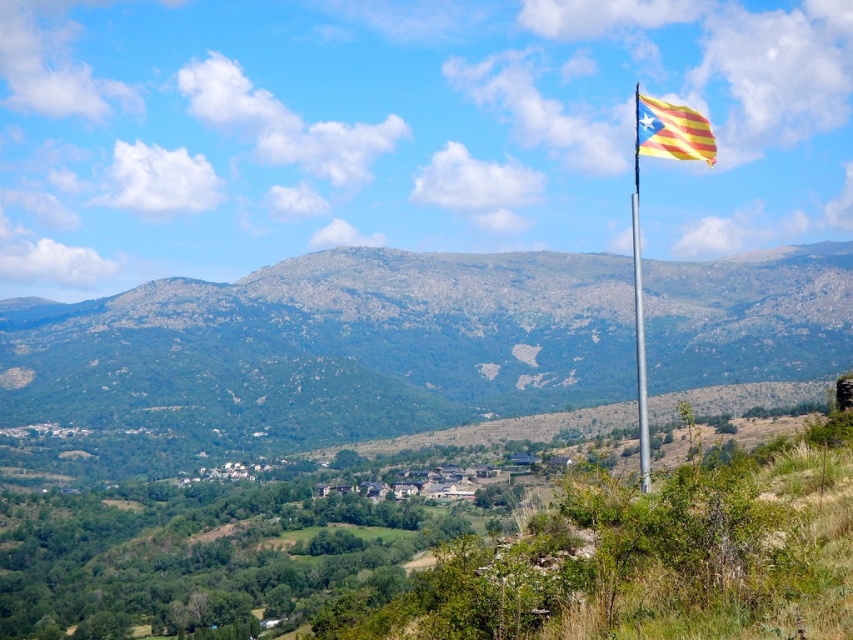
Question: Can you confirm if green rocky mountain at center is positioned to the right of yellow striped fabric at upper right?

Choices:
 (A) yes
 (B) no

Answer: (B)

Question: Does green rocky mountain at center appear over yellow striped fabric at upper right?

Choices:
 (A) no
 (B) yes

Answer: (A)

Question: Which of the following is the closest to the observer?

Choices:
 (A) yellow striped fabric at upper right
 (B) green rocky mountain at center

Answer: (A)

Question: Which point is closer to the camera?

Choices:
 (A) green rocky mountain at center
 (B) yellow striped fabric at upper right

Answer: (B)

Question: Does green rocky mountain at center lie behind yellow striped fabric at upper right?

Choices:
 (A) no
 (B) yes

Answer: (B)